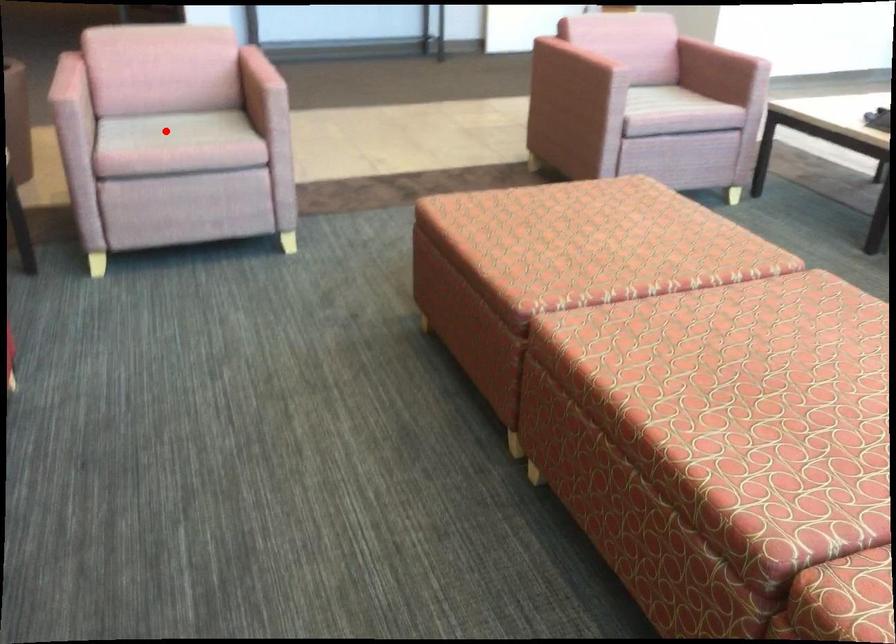
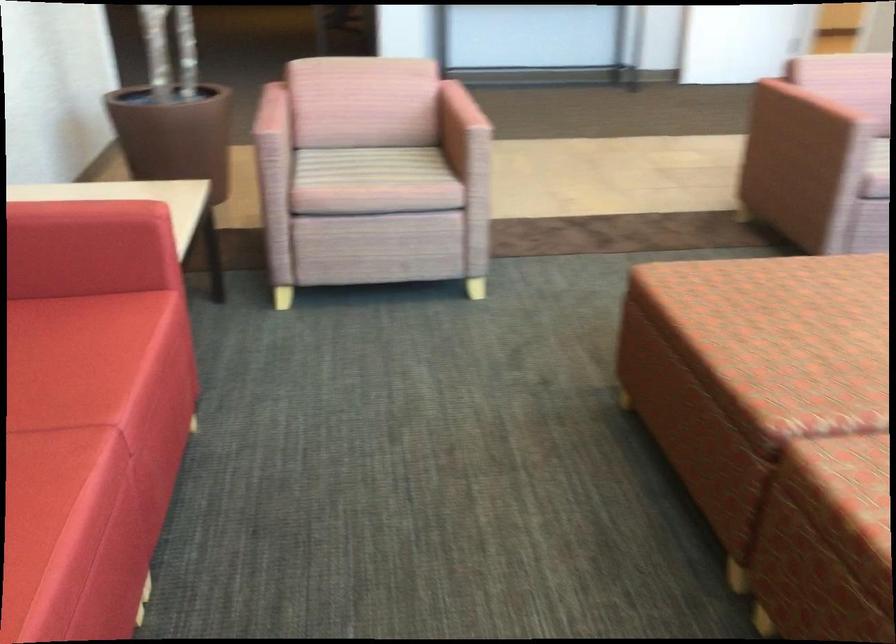
Locate, in the second image, the point that corresponds to the highlighted location in the first image.

(365, 166)